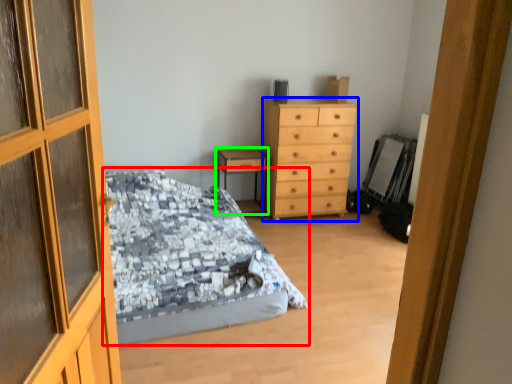
Question: Based on their relative distances, which object is nearer to bed (highlighted by a red box)? Choose from chest of drawers (highlighted by a blue box) and nightstand (highlighted by a green box).

Choices:
 (A) chest of drawers
 (B) nightstand

Answer: (A)